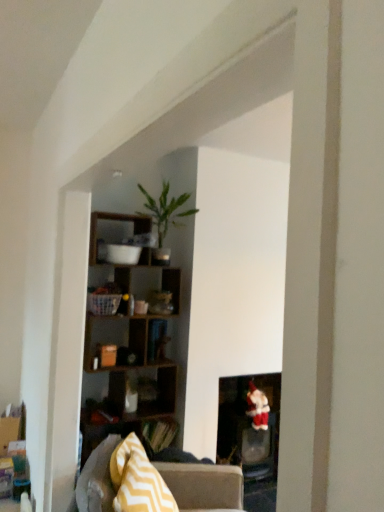
Question: Is velvet santa at lower right closer to the viewer compared to gray fabric couch at center?

Choices:
 (A) no
 (B) yes

Answer: (A)

Question: Considering the relative sizes of velvet santa at lower right and gray fabric couch at center in the image provided, is velvet santa at lower right wider than gray fabric couch at center?

Choices:
 (A) no
 (B) yes

Answer: (A)

Question: From a real-world perspective, is velvet santa at lower right beneath gray fabric couch at center?

Choices:
 (A) yes
 (B) no

Answer: (B)

Question: Is velvet santa at lower right looking in the opposite direction of gray fabric couch at center?

Choices:
 (A) no
 (B) yes

Answer: (A)

Question: Does velvet santa at lower right have a lesser height compared to gray fabric couch at center?

Choices:
 (A) no
 (B) yes

Answer: (B)

Question: Is velvet santa at lower right directly adjacent to gray fabric couch at center?

Choices:
 (A) no
 (B) yes

Answer: (A)

Question: Considering the relative sizes of wooden cube shelf at upper center and matte black fireplace at lower right in the image provided, is wooden cube shelf at upper center shorter than matte black fireplace at lower right?

Choices:
 (A) no
 (B) yes

Answer: (A)

Question: Can you confirm if wooden cube shelf at upper center is positioned to the right of matte black fireplace at lower right?

Choices:
 (A) no
 (B) yes

Answer: (A)

Question: Is wooden cube shelf at upper center facing towards matte black fireplace at lower right?

Choices:
 (A) yes
 (B) no

Answer: (B)

Question: Does wooden cube shelf at upper center have a lesser width compared to matte black fireplace at lower right?

Choices:
 (A) no
 (B) yes

Answer: (B)

Question: Does wooden cube shelf at upper center touch matte black fireplace at lower right?

Choices:
 (A) yes
 (B) no

Answer: (B)

Question: From the image's perspective, would you say wooden cube shelf at upper center is positioned over matte black fireplace at lower right?

Choices:
 (A) yes
 (B) no

Answer: (A)

Question: Is matte black fireplace at lower right inside gray fabric couch at center?

Choices:
 (A) yes
 (B) no

Answer: (B)